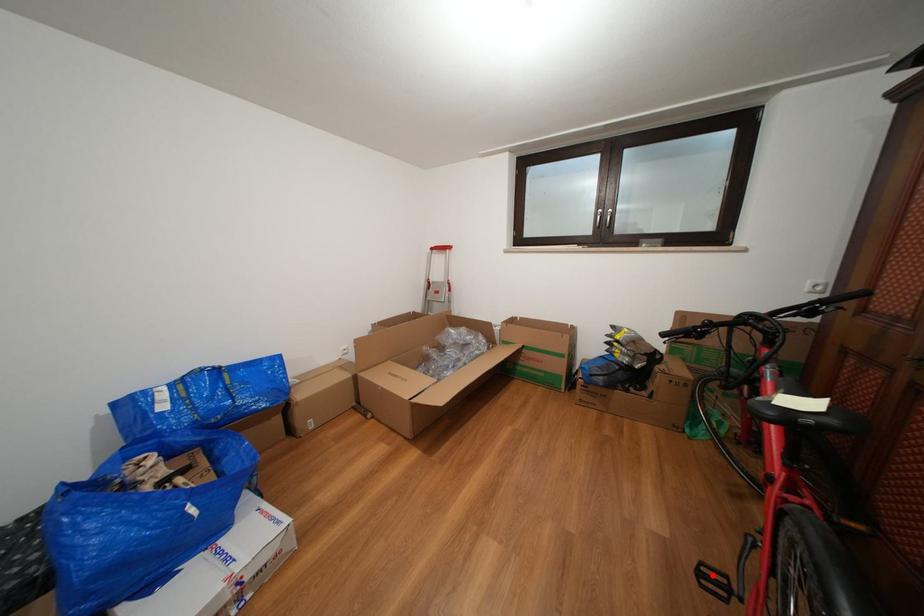
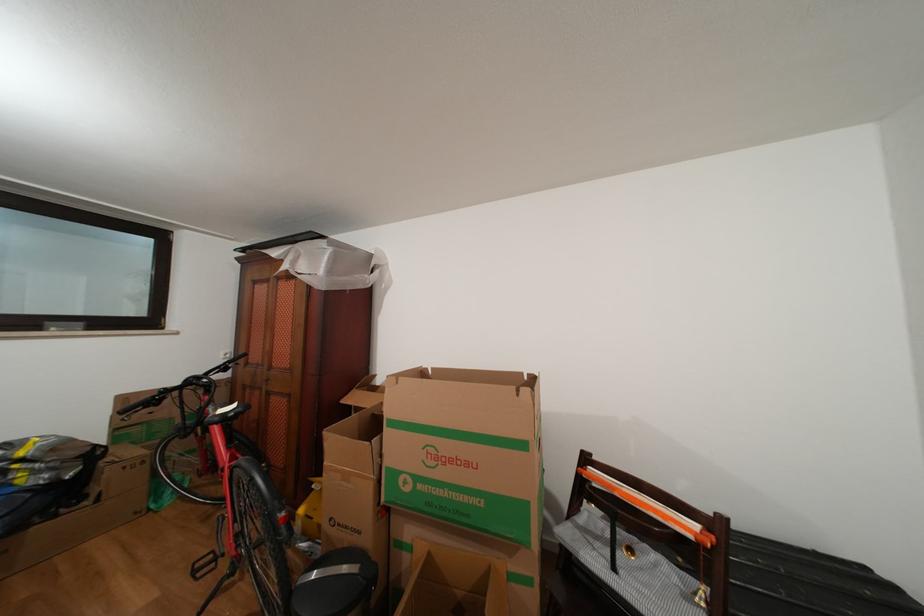
Find the pixel in the second image that matches the highlighted location in the first image.

(205, 570)